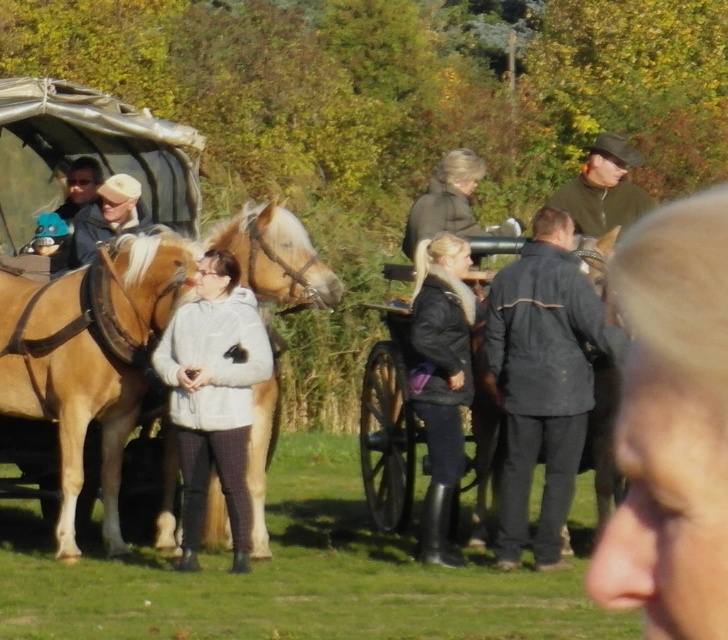
Question: Does smooth beige coat at center have a greater width compared to wooden wagon at center?

Choices:
 (A) yes
 (B) no

Answer: (A)

Question: Observing the image, what is the correct spatial positioning of wooden wagon at center in reference to black leather jacket at center?

Choices:
 (A) right
 (B) left

Answer: (B)

Question: Which point is farther to the camera?

Choices:
 (A) (276, 218)
 (B) (561, 352)
 (C) (617, 216)
 (D) (427, 333)

Answer: (C)

Question: Where is smooth beige coat at center located in relation to white fleece jacket at center in the image?

Choices:
 (A) right
 (B) left

Answer: (A)

Question: Which is farther from the green woolen hat at upper right?

Choices:
 (A) light brown leather horse at center
 (B) black leather jacket at center

Answer: (A)

Question: Based on their relative distances, which object is farther from the green woolen hat at upper right?

Choices:
 (A) white fleece jacket at center
 (B) black leather jacket at center

Answer: (A)